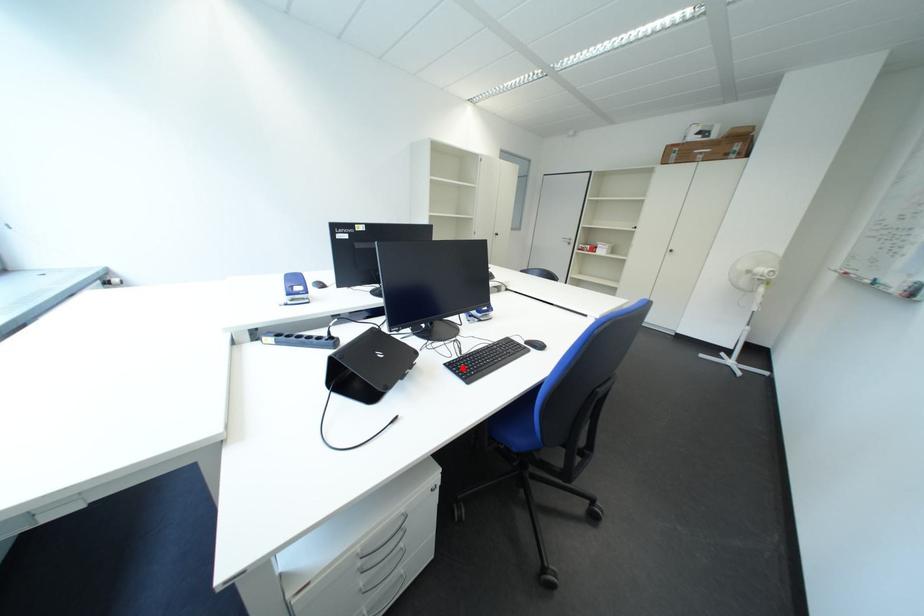
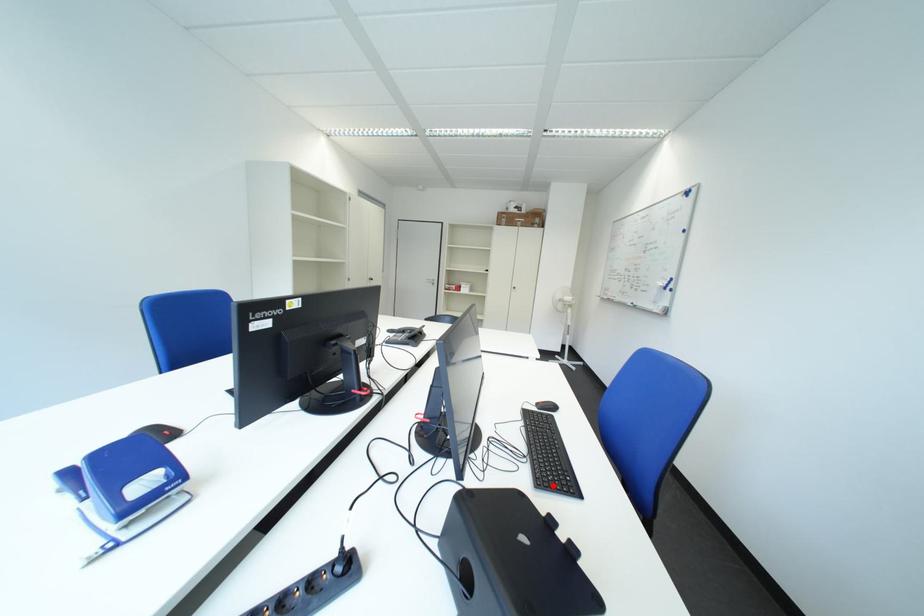
I am providing you with two images of the same scene from different viewpoints. A red point is marked on the first image and another point is marked on the second image. Does the point marked in image1 correspond to the same location as the one in image2?

Yes